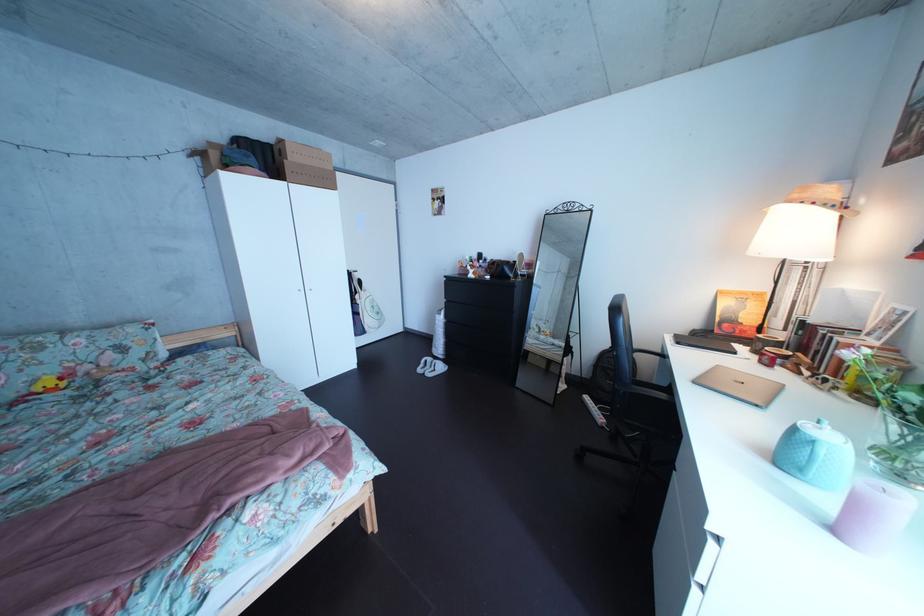
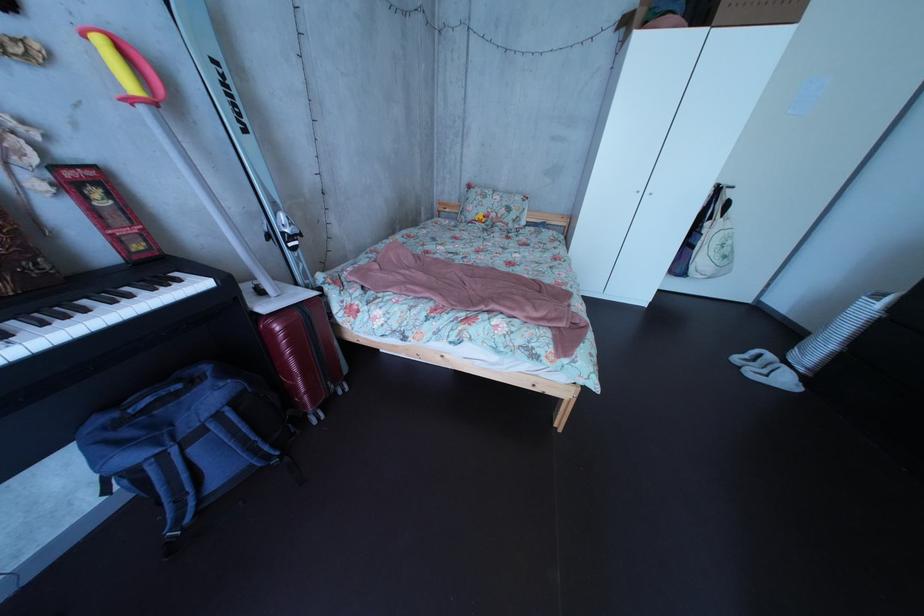
Locate, in the second image, the point that corresponds to the point at 444,368 in the first image.

(784, 363)